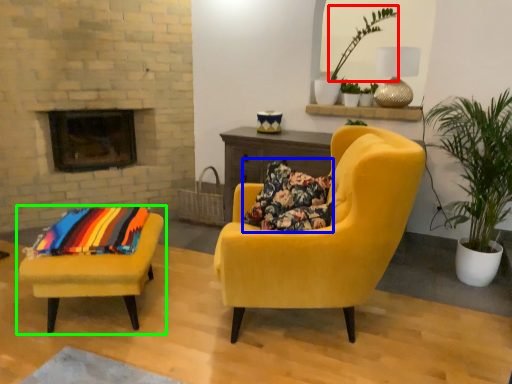
Question: Which object is the farthest from plant (highlighted by a red box)? Choose among these: pillow (highlighted by a blue box) or chair (highlighted by a green box).

Choices:
 (A) pillow
 (B) chair

Answer: (B)